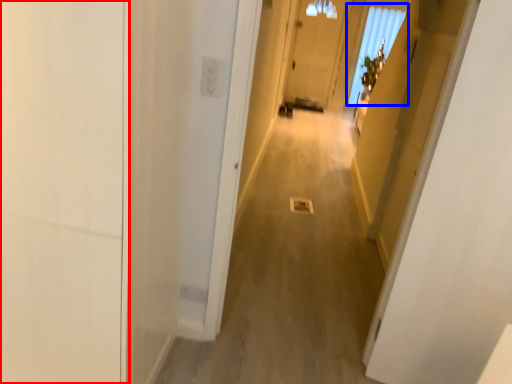
Question: Which object is further to the camera taking this photo, door (highlighted by a red box) or window (highlighted by a blue box)?

Choices:
 (A) door
 (B) window

Answer: (B)